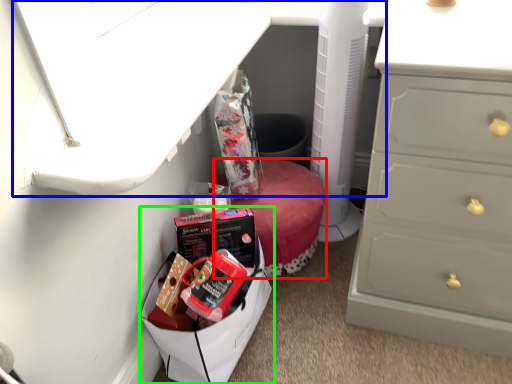
Question: Which object is positioned closest to furniture (highlighted by a red box)? Select from vanity (highlighted by a blue box) and lunch box (highlighted by a green box).

Choices:
 (A) vanity
 (B) lunch box

Answer: (B)